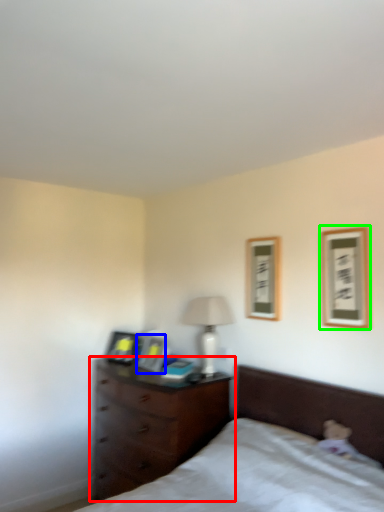
Question: Which object is the farthest from chest of drawers (highlighted by a red box)? Choose among these: picture frame (highlighted by a blue box) or picture frame (highlighted by a green box).

Choices:
 (A) picture frame
 (B) picture frame

Answer: (B)